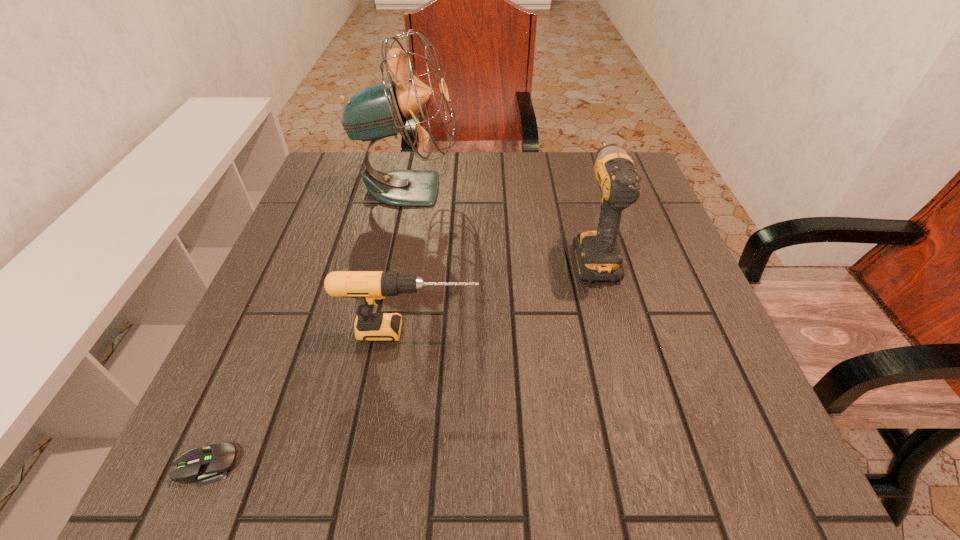
Find the location of a particular element. This screenshot has height=540, width=960. vacant space situated with the drill bit of the taller drill facing forward is located at coordinates (571, 171).

Locate an element on the screen. The height and width of the screenshot is (540, 960). vacant space located with the drill bit of the taller drill facing forward is located at coordinates (581, 209).

Where is `vacant area located on the handle side of the third farthest object`? The image size is (960, 540). vacant area located on the handle side of the third farthest object is located at coordinates (634, 332).

Image resolution: width=960 pixels, height=540 pixels. Find the location of `vacant area situated 0.320m on the back of the leftmost object`. vacant area situated 0.320m on the back of the leftmost object is located at coordinates (284, 286).

Where is `object that is at the far edge`? object that is at the far edge is located at coordinates (381, 110).

This screenshot has height=540, width=960. I want to click on object present at the near edge, so click(210, 464).

I want to click on fan at the left edge, so click(381, 110).

Where is `computer mouse that is at the left edge`? The height and width of the screenshot is (540, 960). computer mouse that is at the left edge is located at coordinates (210, 464).

Find the location of a particular element. This screenshot has height=540, width=960. object at the right edge is located at coordinates (597, 254).

Locate an element on the screen. object that is at the far left corner is located at coordinates (381, 110).